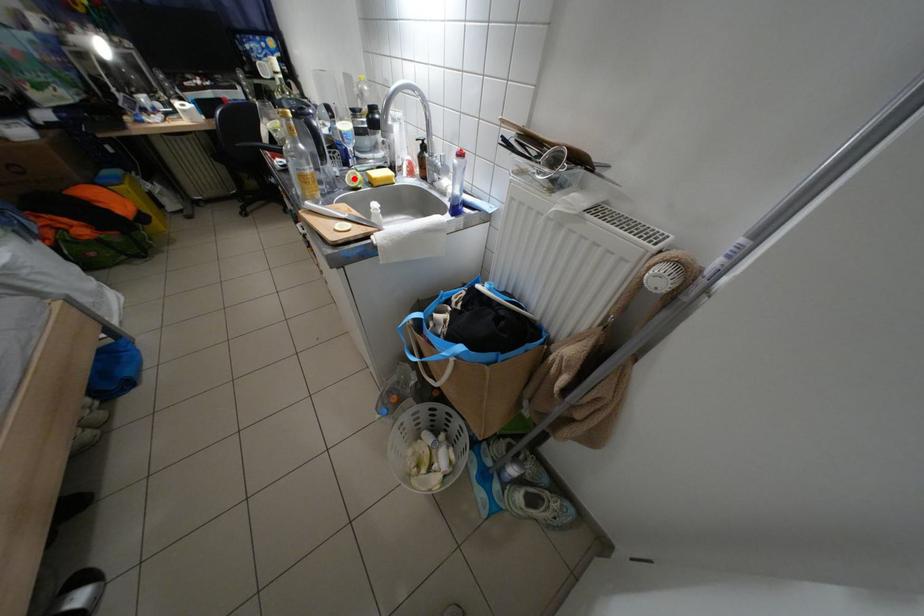
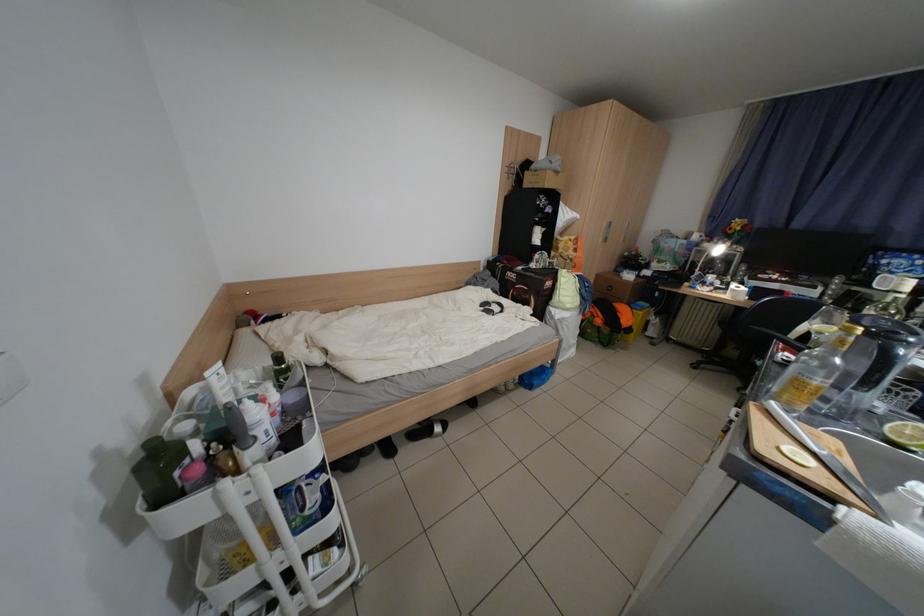
Question: A red point is marked in image1. In image2, is the corresponding 3D point closer to the camera or farther? Reply with the corresponding letter.

Choices:
 (A) The corresponding 3D point is closer.
 (B) The corresponding 3D point is farther.

Answer: (B)